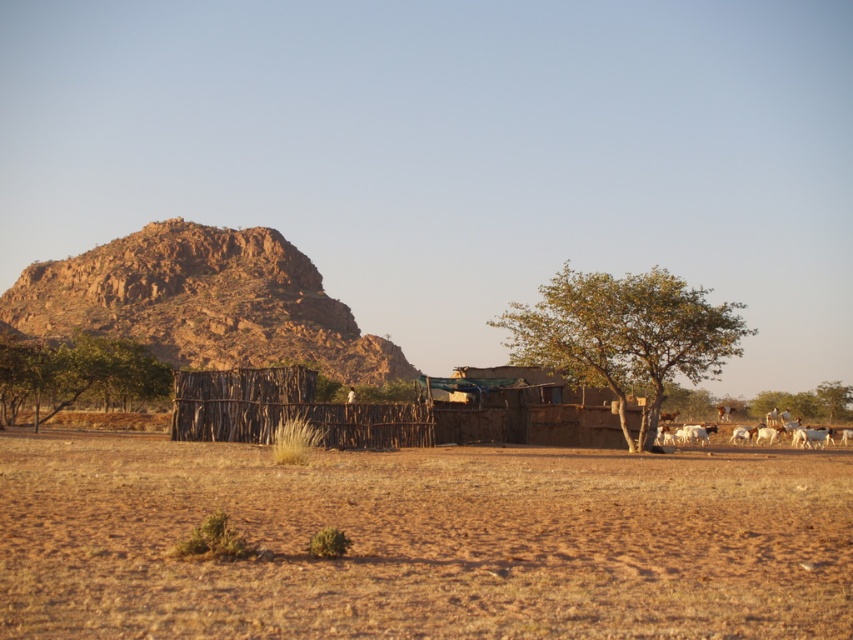
Question: Does green leafy tree at center come in front of green leafy tree at left?

Choices:
 (A) no
 (B) yes

Answer: (B)

Question: Based on their relative distances, which object is farther from the green leafy tree at center?

Choices:
 (A) rustic rock formation at upper left
 (B) white woolly goats at right
 (C) green leafy tree at left

Answer: (A)

Question: Which of the following is the farthest from the observer?

Choices:
 (A) rustic rock formation at upper left
 (B) brown dry soil at center
 (C) white woolly goats at right
 (D) green leafy tree at left

Answer: (A)

Question: Which point is farther to the camera?

Choices:
 (A) 657,429
 (B) 515,595

Answer: (A)

Question: Is brown dry soil at center below green leafy tree at left?

Choices:
 (A) yes
 (B) no

Answer: (A)

Question: Where is brown dry soil at center located in relation to green leafy tree at center in the image?

Choices:
 (A) right
 (B) left

Answer: (B)